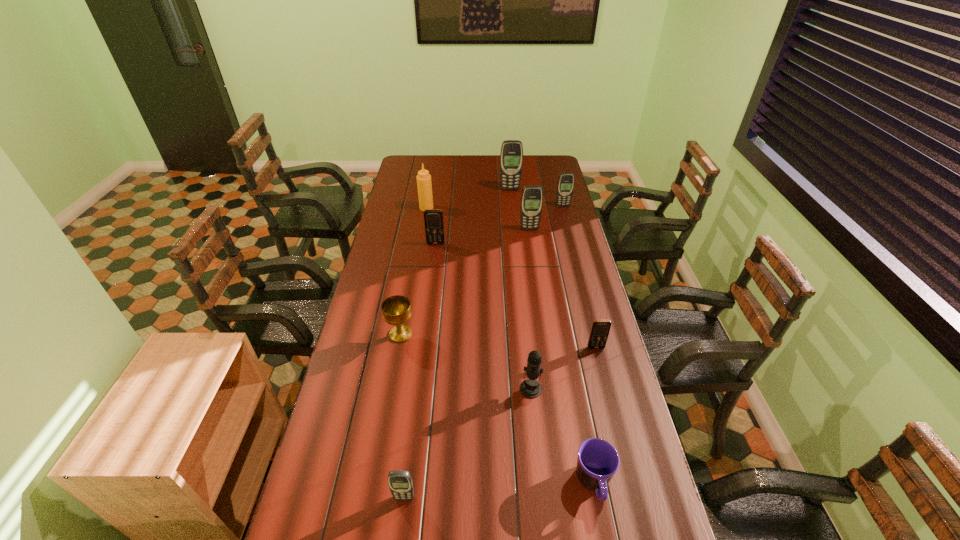
Identify the location of blank region between the smallest gray cellular telephone and the fifth shortest cellular telephone. The width and height of the screenshot is (960, 540). (467, 363).

Where is `free space between the mug and the tallest cellular telephone`? free space between the mug and the tallest cellular telephone is located at coordinates (552, 337).

Identify which object is the ninth nearest to the second biggest gray cellular telephone. Please provide its 2D coordinates. Your answer should be formatted as a tuple, i.e. [(x, y)], where the tuple contains the x and y coordinates of a point satisfying the conditions above.

[(400, 483)]

Select which object appears as the eighth closest to the tan condiment. Please provide its 2D coordinates. Your answer should be formatted as a tuple, i.e. [(x, y)], where the tuple contains the x and y coordinates of a point satisfying the conditions above.

[(598, 461)]

Where is `cellular telephone object that ranks as the fourth closest to the second nearest cellular telephone`? cellular telephone object that ranks as the fourth closest to the second nearest cellular telephone is located at coordinates (565, 187).

The height and width of the screenshot is (540, 960). Identify the location of the fifth closest cellular telephone to the black mug. (565, 187).

Point out which gray cellular telephone is positioned as the fourth nearest to the bigger orange cellular telephone. Please provide its 2D coordinates. Your answer should be formatted as a tuple, i.e. [(x, y)], where the tuple contains the x and y coordinates of a point satisfying the conditions above.

[(400, 483)]

Locate which gray cellular telephone ranks second in proximity to the black mug. Please provide its 2D coordinates. Your answer should be formatted as a tuple, i.e. [(x, y)], where the tuple contains the x and y coordinates of a point satisfying the conditions above.

[(532, 196)]

You are a GUI agent. You are given a task and a screenshot of the screen. Output one action in this format:
    pyautogui.click(x=<x>, y=<y>)
    Task: Click on the vacant region that satisfies the following two spatial constraints: 1. on the screen of the third nearest object; 2. on the left side of the left orange cellular telephone
    The image size is (960, 540).
    Given the screenshot: What is the action you would take?
    pyautogui.click(x=418, y=389)

This screenshot has width=960, height=540. Identify the location of blank area in the image that satisfies the following two spatial constraints: 1. on the front side of the third nearest object; 2. on the left side of the tan condiment. (396, 389).